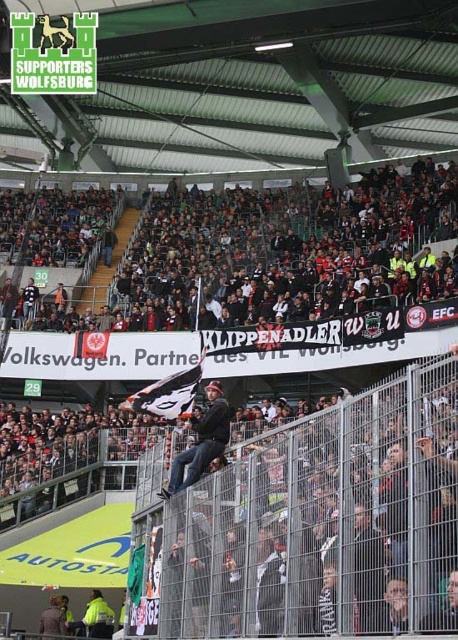
You are a spectator at the stadium and want to retrieve your jacket, which is the dark gray denim jacket at center. However, you notice it is near the metallic silver fence at center. Can you safely reach your jacket without climbing over the fence?

The metallic silver fence at center is located below the dark gray denim jacket at center, so the jacket is positioned above the fence. You can safely reach it without climbing over the fence by accessing it from the spectator side.

You are a photographer standing behind the metal fence at the sports stadium. You want to take a photo of the dark gray denim jacket at center without the dark gray fabric crowd at center blocking the view. Is this possible based on their positions?

The dark gray fabric crowd at center is further to the viewer than the dark gray denim jacket at center, so the crowd is closer to you. This means the crowd would block the view of the jacket, making it impossible to take a clear photo of the dark gray denim jacket at center without obstruction.

You are a photographer trying to capture a clear photo of the dark gray denim jacket at center. However, the dark gray fabric crowd at center is blocking your view. Can you estimate if the crowd is bigger than the jacket?

The dark gray fabric crowd at center has a larger size compared to the dark gray denim jacket at center, so yes, the crowd is bigger than the jacket and might block the view.